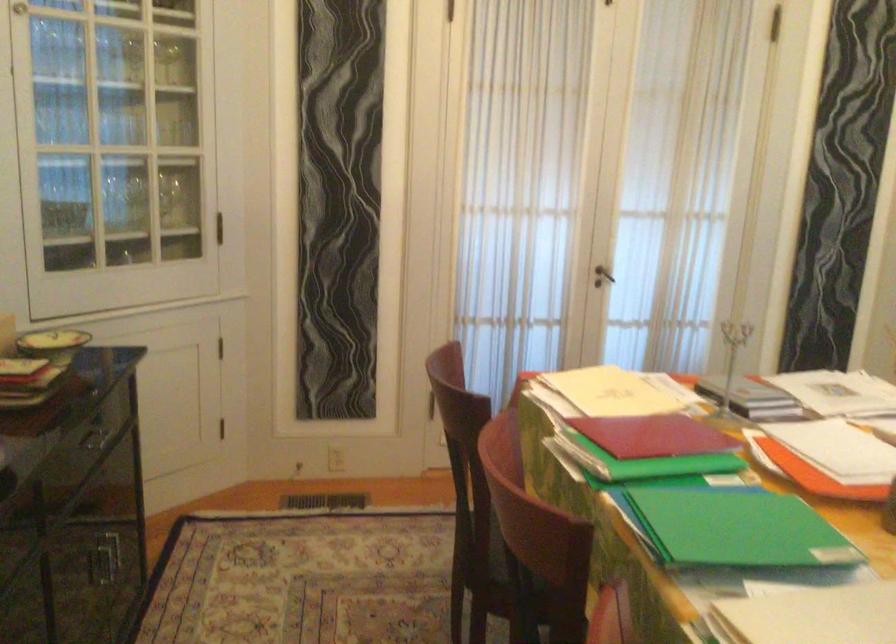
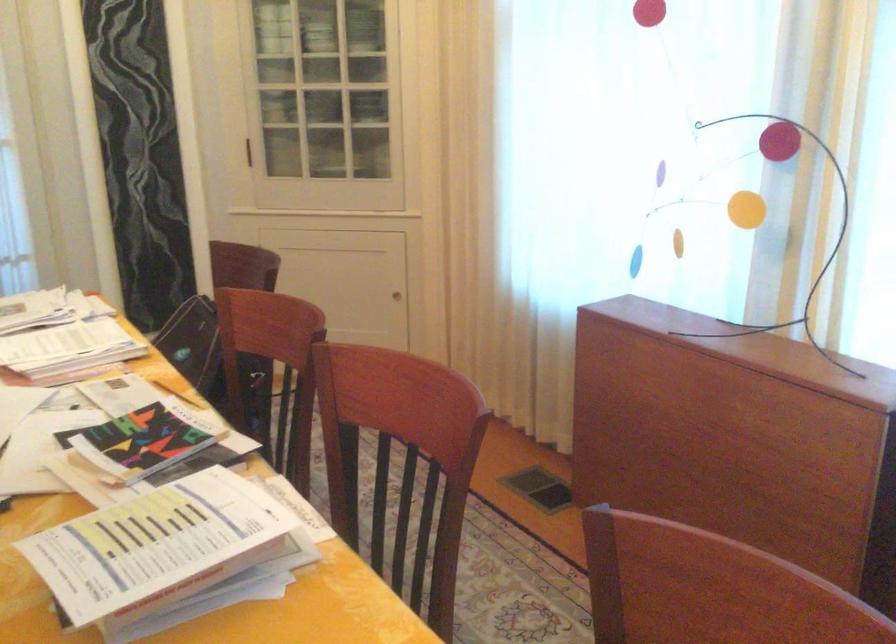
Question: In a continuous first-person perspective shot, in which direction is the camera moving?

Choices:
 (A) Left
 (B) Right
 (C) Forward
 (D) Backward

Answer: (B)